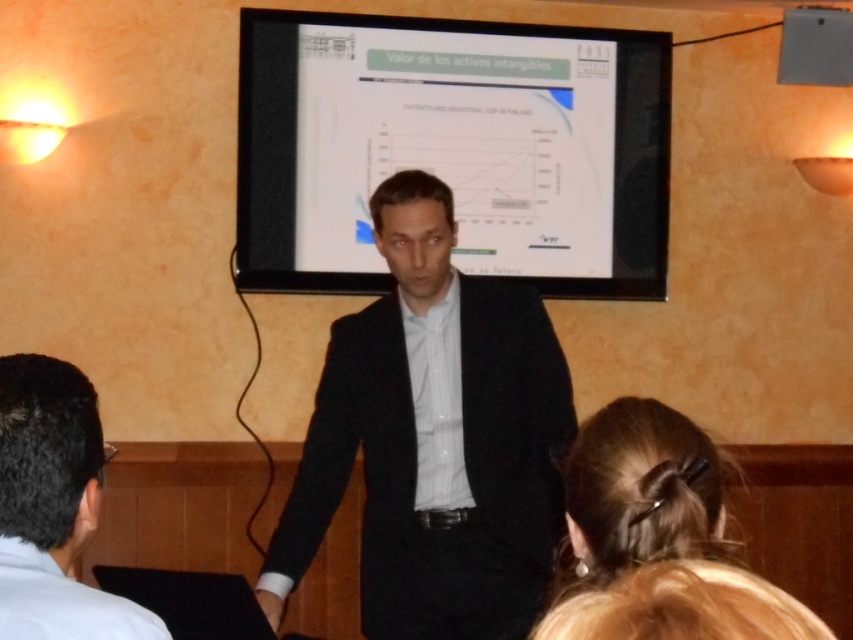
You are an event planner standing at the back of the room. You need to ensure that both the matte black screen at center and the black wool suit at center are visible to the audience. Which object is shorter and might require adjustment for better visibility?

The matte black screen at center is shorter than the black wool suit at center, so it might require adjustment for better visibility.

You are an attendee at the presentation and want to know which point is closer to you between the point at coordinates point (x=28, y=563) and point (x=618, y=497). Can you determine this based on their positions?

Point point (x=28, y=563) is in front of point point (x=618, y=497), so it is closer to you.

You are an attendee at the presentation. You notice the matte black screen at center and the black wool suit at center. Which object is positioned higher in the image?

The matte black screen at center is positioned higher than the black wool suit at center.